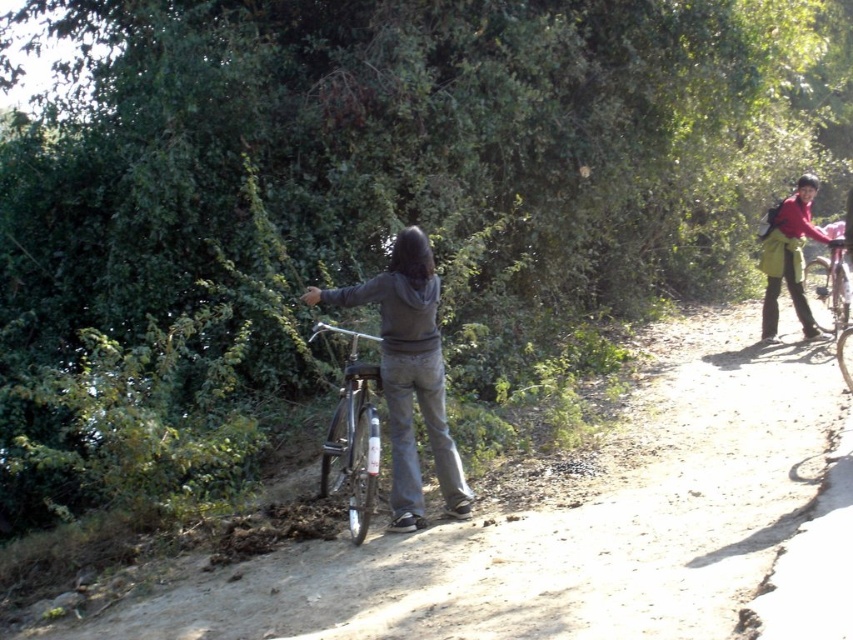
This screenshot has width=853, height=640. Describe the element at coordinates (563, 524) in the screenshot. I see `matte black bicycle at center` at that location.

Who is positioned more to the right, matte black bicycle at center or red fabric backpack at upper right?

red fabric backpack at upper right

Which is behind, point (207, 595) or point (785, 273)?

Positioned behind is point (785, 273).

Where is `matte black bicycle at center`? The width and height of the screenshot is (853, 640). matte black bicycle at center is located at coordinates (563, 524).

Between point (561, 465) and point (357, 339), which one is positioned in front?

Point (561, 465)

Which is more to the left, matte black bicycle at center or shiny metallic bicycle at center?

From the viewer's perspective, shiny metallic bicycle at center appears more on the left side.

Identify the location of matte black bicycle at center. (563, 524).

Between shiny metallic bicycle at center and red fabric backpack at upper right, which one has more height?

Standing taller between the two is red fabric backpack at upper right.

Describe the element at coordinates (352, 435) in the screenshot. The width and height of the screenshot is (853, 640). I see `shiny metallic bicycle at center` at that location.

Locate an element on the screen. shiny metallic bicycle at center is located at coordinates (352, 435).